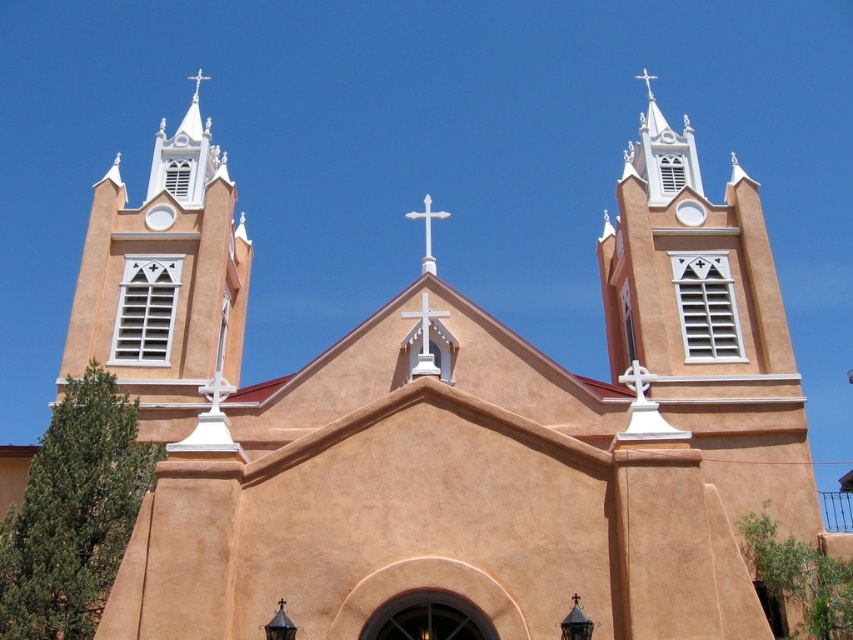
Question: Which of the following is the closest to the observer?

Choices:
 (A) white stucco tower at upper left
 (B) white matte cross at center

Answer: (A)

Question: Which object is farther from the camera taking this photo?

Choices:
 (A) white matte cross at center
 (B) white stucco tower at upper left

Answer: (A)

Question: From the image, what is the correct spatial relationship of white stucco tower at upper left in relation to white matte cross at center?

Choices:
 (A) below
 (B) above

Answer: (B)

Question: In this image, where is white stucco tower at upper left located relative to white matte cross at center?

Choices:
 (A) left
 (B) right

Answer: (A)

Question: Is white stucco tower at upper left positioned behind white matte cross at center?

Choices:
 (A) yes
 (B) no

Answer: (B)